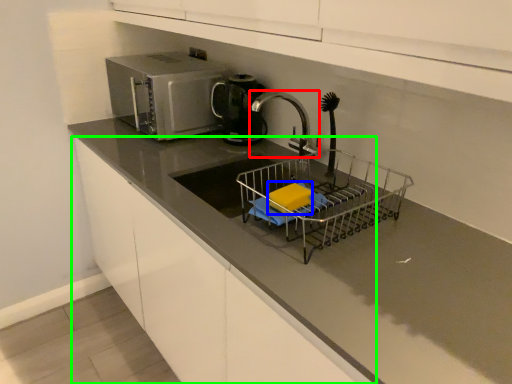
Question: Based on their relative distances, which object is nearer to tap (highlighted by a red box)? Choose from food (highlighted by a blue box) and cabinetry (highlighted by a green box).

Choices:
 (A) food
 (B) cabinetry

Answer: (A)